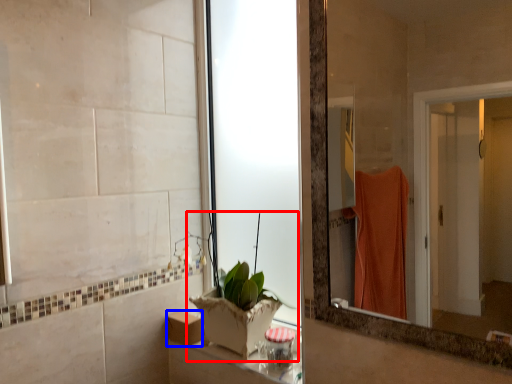
Question: Which point is further to the camera, houseplant (highlighted by a red box) or box (highlighted by a blue box)?

Choices:
 (A) houseplant
 (B) box

Answer: (B)